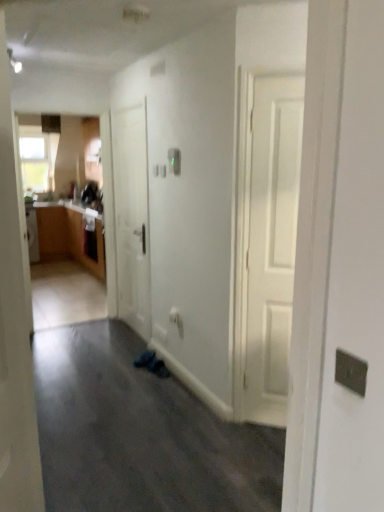
Question: Is white matte door at left, which is counted as the first door, starting from the right, taller than clear glass window at upper left?

Choices:
 (A) no
 (B) yes

Answer: (B)

Question: Does white matte door at left, which is the first door from front to back, appear on the left side of clear glass window at upper left?

Choices:
 (A) no
 (B) yes

Answer: (A)

Question: Does white matte door at left, the 2th door from the back, have a smaller size compared to clear glass window at upper left?

Choices:
 (A) no
 (B) yes

Answer: (A)

Question: Are white matte door at left, which is the first door from front to back, and clear glass window at upper left beside each other?

Choices:
 (A) yes
 (B) no

Answer: (B)

Question: From a real-world perspective, is white matte door at left, which appears as the second door when viewed from the left, located higher than clear glass window at upper left?

Choices:
 (A) yes
 (B) no

Answer: (B)

Question: Relative to white matte door at left, which is counted as the first door, starting from the right, is white matte door at center, acting as the first door starting from the left, in front or behind?

Choices:
 (A) front
 (B) behind

Answer: (B)

Question: From the image's perspective, is white matte door at center, acting as the first door starting from the left, located above or below white matte door at left, which is counted as the first door, starting from the right?

Choices:
 (A) below
 (B) above

Answer: (B)

Question: From a real-world perspective, is white matte door at center, the 2th door in the front-to-back sequence, physically located above or below white matte door at left, which is counted as the first door, starting from the right?

Choices:
 (A) below
 (B) above

Answer: (A)

Question: From their relative heights in the image, would you say white matte door at center, acting as the first door starting from the left, is taller or shorter than white matte door at left, which is the first door from front to back?

Choices:
 (A) short
 (B) tall

Answer: (B)

Question: Is clear glass window at upper left taller or shorter than white matte door at center, the 2th door in the front-to-back sequence?

Choices:
 (A) tall
 (B) short

Answer: (B)

Question: Based on their sizes in the image, would you say clear glass window at upper left is bigger or smaller than white matte door at center, the 2th door in the front-to-back sequence?

Choices:
 (A) small
 (B) big

Answer: (A)

Question: In the image, is clear glass window at upper left on the left side or the right side of white matte door at center, acting as the first door starting from the left?

Choices:
 (A) left
 (B) right

Answer: (A)

Question: Does point (38, 174) appear closer or farther from the camera than point (145, 318)?

Choices:
 (A) closer
 (B) farther

Answer: (B)

Question: Would you say dark gray carpet at lower center is to the left or to the right of white matte door at center, acting as the 1th door starting from the back, in the picture?

Choices:
 (A) left
 (B) right

Answer: (A)

Question: Is dark gray carpet at lower center inside or outside of white matte door at center, acting as the 1th door starting from the back?

Choices:
 (A) inside
 (B) outside

Answer: (B)